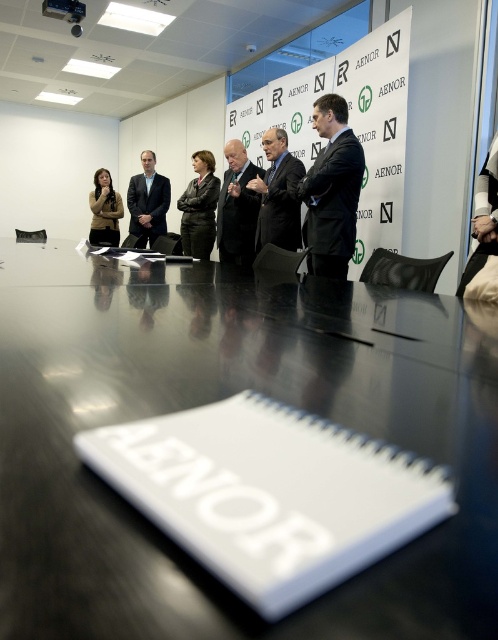
Question: Does dark gray suit at center have a lesser width compared to dark blue suit at center?

Choices:
 (A) yes
 (B) no

Answer: (B)

Question: Which point is farther to the camera?

Choices:
 (A) (472, 435)
 (B) (232, 244)
 (C) (142, 224)
 (D) (326, 259)

Answer: (C)

Question: Is dark blue suit at center thinner than dark gray wool business suit at center?

Choices:
 (A) yes
 (B) no

Answer: (A)

Question: Does dark blue suit at center have a greater width compared to matte brown jacket at left?

Choices:
 (A) yes
 (B) no

Answer: (B)

Question: Estimate the real-world distances between objects in this image. Which object is farther from the dark gray leather jacket at center?

Choices:
 (A) dark blue suit at center
 (B) black glossy table at center
 (C) matte brown jacket at left
 (D) dark gray wool business suit at center

Answer: (B)

Question: Which object is the closest to the matte brown jacket at left?

Choices:
 (A) dark blue suit at center
 (B) dark gray leather jacket at center
 (C) dark gray wool business suit at center
 (D) black glossy table at center

Answer: (B)